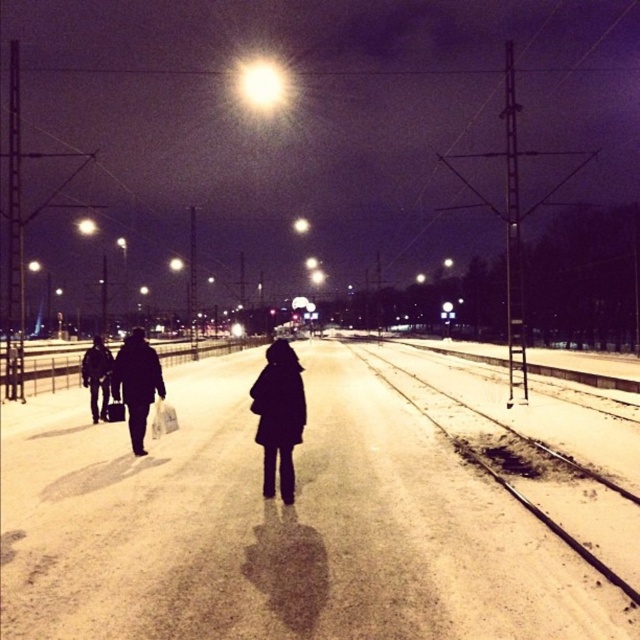
In the scene shown: Is black matte coat at center bigger than dark matte coat at left?

Yes, black matte coat at center is bigger than dark matte coat at left.

Is black matte coat at center positioned before dark matte coat at left?

Yes, black matte coat at center is closer to the viewer.

Measure the distance between point (275, 456) and camera.

Point (275, 456) and camera are 8.45 meters apart.

You are a GUI agent. You are given a task and a screenshot of the screen. Output one action in this format:
    pyautogui.click(x=<x>, y=<y>)
    Task: Click on the black matte coat at center
    This screenshot has width=640, height=640.
    Given the screenshot: What is the action you would take?
    pyautogui.click(x=278, y=416)

Based on the photo, who is more forward, (512, 518) or (97, 413)?

Positioned in front is point (512, 518).

Which of these two, smooth concrete train track at center or dark matte coat at left, stands shorter?

smooth concrete train track at center is shorter.

Describe the element at coordinates (522, 451) in the screenshot. I see `smooth concrete train track at center` at that location.

Locate an element on the screen. Image resolution: width=640 pixels, height=640 pixels. smooth concrete train track at center is located at coordinates (522, 451).

Does point (552, 545) lie behind point (138, 378)?

No, it is in front of (138, 378).

Can you confirm if smooth concrete train track at center is bigger than dark matte coat at center?

Incorrect, smooth concrete train track at center is not larger than dark matte coat at center.

The height and width of the screenshot is (640, 640). Find the location of `smooth concrete train track at center`. smooth concrete train track at center is located at coordinates (522, 451).

Locate an element on the screen. The width and height of the screenshot is (640, 640). smooth concrete train track at center is located at coordinates (522, 451).